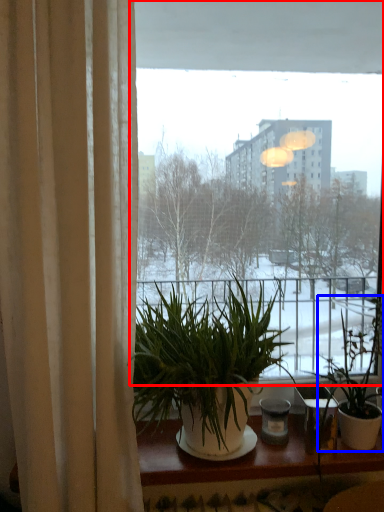
Question: Which point is closer to the camera, window (highlighted by a red box) or houseplant (highlighted by a blue box)?

Choices:
 (A) window
 (B) houseplant

Answer: (B)